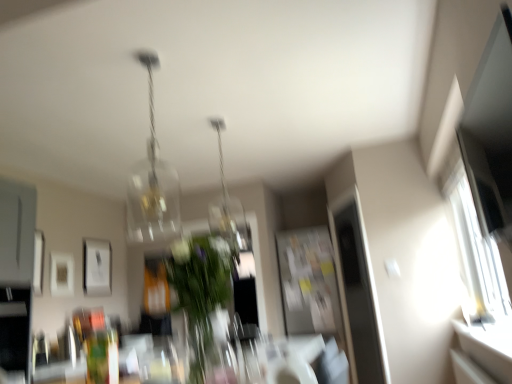
You are a GUI agent. You are given a task and a screenshot of the screen. Output one action in this format:
    pyautogui.click(x=<x>, y=<y>)
    Task: Click on the white matte picture frame at left, arranged as the 2th picture frame when viewed from the front
    This screenshot has height=384, width=512.
    Given the screenshot: What is the action you would take?
    pyautogui.click(x=61, y=274)

Image resolution: width=512 pixels, height=384 pixels. What do you see at coordinates (211, 351) in the screenshot? I see `transparent glass vase at center` at bounding box center [211, 351].

In order to face clear glass pendant light at center, positioned as the 1th lamp in back-to-front order, should I rotate leftwards or rightwards?

To align with it, rotate left about 4.760°.

In order to click on white glossy table at center in this screenshot , I will do `click(308, 346)`.

The width and height of the screenshot is (512, 384). Describe the element at coordinates (38, 262) in the screenshot. I see `matte white picture frame at left, which is counted as the first picture frame, starting from the left` at that location.

Find the location of a particular element. The image size is (512, 384). white matte picture frame at left, positioned as the 2th picture frame in back-to-front order is located at coordinates (61, 274).

Does point (224, 332) appear closer or farther from the camera than point (69, 283)?

Point (224, 332) is closer to the camera than point (69, 283).

Which object is thinner, transparent glass vase at center or white matte picture frame at left, positioned as the 2th picture frame in back-to-front order?

white matte picture frame at left, positioned as the 2th picture frame in back-to-front order.

How different are the orientations of transparent glass vase at center and white matte picture frame at left, positioned as the 2th picture frame in back-to-front order, in degrees?

The facing directions of transparent glass vase at center and white matte picture frame at left, positioned as the 2th picture frame in back-to-front order, are 1.82 degrees apart.

From a real-world perspective, is white matte picture frame at left, positioned as the 2th picture frame in back-to-front order, positioned over white matte picture frame at upper left, the 1th picture frame when ordered from back to front, based on gravity?

No.

From the white matte picture frame at upper left, arranged as the third picture frame when viewed from the front, count the 1st picture frame to the left and point to it. Please provide its 2D coordinates.

[(61, 274)]

In the scene shown: In terms of width, does white matte picture frame at left, arranged as the 2th picture frame when viewed from the front, look wider or thinner when compared to white matte picture frame at upper left, arranged as the third picture frame when viewed from the front?

white matte picture frame at left, arranged as the 2th picture frame when viewed from the front, is thinner than white matte picture frame at upper left, arranged as the third picture frame when viewed from the front.

Is translucent glass chandelier at upper center, positioned as the first lamp in front-to-back order, aimed at transparent glass vase at center?

No, translucent glass chandelier at upper center, positioned as the first lamp in front-to-back order, does not turn towards transparent glass vase at center.

Considering the sizes of objects translucent glass chandelier at upper center, positioned as the first lamp in front-to-back order, and transparent glass vase at center in the image provided, who is shorter, translucent glass chandelier at upper center, positioned as the first lamp in front-to-back order, or transparent glass vase at center?

transparent glass vase at center is shorter.

From the image's perspective, is translucent glass chandelier at upper center, which appears as the 2th lamp when viewed from the back, beneath transparent glass vase at center?

Actually, translucent glass chandelier at upper center, which appears as the 2th lamp when viewed from the back, appears above transparent glass vase at center in the image.

Is translucent glass chandelier at upper center, positioned as the 2th lamp in right-to-left order, far away from transparent glass vase at center?

Yes.

Looking at this image, from the image's perspective, does white matte picture frame at left, which is counted as the 2th picture frame, starting from the right, appear lower than green leafy plant at center?

Yes, from the image's perspective, white matte picture frame at left, which is counted as the 2th picture frame, starting from the right, is below green leafy plant at center.

Is point (52, 287) positioned behind point (200, 265)?

Yes, it is.

Which is behind, white matte picture frame at left, arranged as the 2th picture frame when viewed from the front, or green leafy plant at center?

white matte picture frame at left, arranged as the 2th picture frame when viewed from the front, is more distant.

Between white glossy table at center and matte white picture frame at left, positioned as the third picture frame in back-to-front order, which one has less height?

With less height is white glossy table at center.

Does white glossy table at center appear on the left side of matte white picture frame at left, the first picture frame from the front?

No, white glossy table at center is not to the left of matte white picture frame at left, the first picture frame from the front.

Does white glossy table at center touch matte white picture frame at left, the first picture frame from the front?

No, white glossy table at center is not with matte white picture frame at left, the first picture frame from the front.

From the image's perspective, is white glossy table at center positioned above or below matte white picture frame at left, the first picture frame from the front?

white glossy table at center is below matte white picture frame at left, the first picture frame from the front.

Does transparent glass vase at center have a larger size compared to matte white picture frame at left, which is counted as the first picture frame, starting from the left?

Incorrect, transparent glass vase at center is not larger than matte white picture frame at left, which is counted as the first picture frame, starting from the left.

Based on the photo, what's the angular difference between transparent glass vase at center and matte white picture frame at left, positioned as the third picture frame in back-to-front order,'s facing directions?

transparent glass vase at center and matte white picture frame at left, positioned as the third picture frame in back-to-front order, are facing 1.82 degrees away from each other.

Visually, is transparent glass vase at center positioned to the left or to the right of matte white picture frame at left, positioned as the third picture frame in back-to-front order?

transparent glass vase at center is to the right of matte white picture frame at left, positioned as the third picture frame in back-to-front order.

Is transparent glass vase at center positioned far away from matte white picture frame at left, which is counted as the first picture frame, starting from the left?

That's right, there is a large distance between transparent glass vase at center and matte white picture frame at left, which is counted as the first picture frame, starting from the left.

Is matte white picture frame at left, the third picture frame when ordered from right to left, behind white matte picture frame at left, placed as the 2th picture frame when sorted from left to right?

No, the depth of matte white picture frame at left, the third picture frame when ordered from right to left, is less than that of white matte picture frame at left, placed as the 2th picture frame when sorted from left to right.

Is matte white picture frame at left, the third picture frame when ordered from right to left, positioned with its back to white matte picture frame at left, positioned as the 2th picture frame in back-to-front order?

matte white picture frame at left, the third picture frame when ordered from right to left, does not have its back to white matte picture frame at left, positioned as the 2th picture frame in back-to-front order.

How many degrees apart are the facing directions of matte white picture frame at left, positioned as the third picture frame in back-to-front order, and white matte picture frame at left, which is counted as the 2th picture frame, starting from the right?

The angle between the facing direction of matte white picture frame at left, positioned as the third picture frame in back-to-front order, and the facing direction of white matte picture frame at left, which is counted as the 2th picture frame, starting from the right, is 0.00135 degrees.

Does point (34, 243) lie behind point (73, 285)?

No, (34, 243) is closer to viewer.

Image resolution: width=512 pixels, height=384 pixels. In order to click on glass vase above the white matte picture frame at left, positioned as the 2th picture frame in back-to-front order (from the image's perspective) in this screenshot , I will do `click(211, 351)`.

I want to click on picture frame that is the 1st object to the left of the white matte picture frame at upper left, the 1th picture frame when ordered from back to front, starting at the anchor, so click(61, 274).

Looking at the image, which one is located closer to matte white picture frame at left, which is counted as the first picture frame, starting from the left, green leafy plant at center or white matte picture frame at left, placed as the 2th picture frame when sorted from left to right?

The object closer to matte white picture frame at left, which is counted as the first picture frame, starting from the left, is white matte picture frame at left, placed as the 2th picture frame when sorted from left to right.

Estimate the real-world distances between objects in this image. Which object is further from clear glass pendant light at center, positioned as the 1th lamp in back-to-front order, matte white picture frame at left, the first picture frame from the front, or white matte picture frame at left, arranged as the 2th picture frame when viewed from the front?

Among the two, matte white picture frame at left, the first picture frame from the front, is located further to clear glass pendant light at center, positioned as the 1th lamp in back-to-front order.

Considering their positions, is white matte picture frame at upper left, the third picture frame viewed from the left, positioned further to white matte picture frame at left, positioned as the 2th picture frame in back-to-front order, than white glossy table at center?

white glossy table at center is positioned further to the anchor white matte picture frame at left, positioned as the 2th picture frame in back-to-front order.

Looking at the image, which one is located further to white matte picture frame at upper left, the 1th picture frame viewed from the right, translucent glass chandelier at upper center, which ranks as the 1th lamp in left-to-right order, or white matte picture frame at left, placed as the 2th picture frame when sorted from left to right?

translucent glass chandelier at upper center, which ranks as the 1th lamp in left-to-right order, lies further to white matte picture frame at upper left, the 1th picture frame viewed from the right, than the other object.

From the image, which object appears to be farther from white matte picture frame at left, arranged as the 2th picture frame when viewed from the front, white glossy table at center or matte white picture frame at left, positioned as the third picture frame in back-to-front order?

Among the two, white glossy table at center is located further to white matte picture frame at left, arranged as the 2th picture frame when viewed from the front.

Looking at the image, which one is located closer to green leafy plant at center, white matte picture frame at left, which is counted as the 2th picture frame, starting from the right, or white glossy table at center?

white matte picture frame at left, which is counted as the 2th picture frame, starting from the right, is closer to green leafy plant at center.

Looking at the image, which one is located closer to white glossy window sill at lower right, clear glass pendant light at center, placed as the first lamp when sorted from right to left, or white matte picture frame at upper left, the 1th picture frame when ordered from back to front?

Based on the image, clear glass pendant light at center, placed as the first lamp when sorted from right to left, appears to be nearer to white glossy window sill at lower right.

Based on the photo, which object lies nearer to the anchor point white glossy window sill at lower right, clear glass pendant light at center, positioned as the 1th lamp in back-to-front order, or green leafy plant at center?

Based on the image, clear glass pendant light at center, positioned as the 1th lamp in back-to-front order, appears to be nearer to white glossy window sill at lower right.

This screenshot has width=512, height=384. Find the location of `picture frame between white glossy table at center and white matte picture frame at left, arranged as the 2th picture frame when viewed from the front, along the z-axis`. picture frame between white glossy table at center and white matte picture frame at left, arranged as the 2th picture frame when viewed from the front, along the z-axis is located at coordinates (38, 262).

Where is `lamp between green leafy plant at center and clear glass pendant light at center, which ranks as the second lamp in left-to-right order, along the z-axis`? Image resolution: width=512 pixels, height=384 pixels. lamp between green leafy plant at center and clear glass pendant light at center, which ranks as the second lamp in left-to-right order, along the z-axis is located at coordinates (152, 183).

Identify the location of houseplant located between clear glass pendant light at center, which is the second lamp in front-to-back order, and white glossy window sill at lower right in the left-right direction. The width and height of the screenshot is (512, 384). (201, 284).

Where is `table situated between clear glass pendant light at center, positioned as the 1th lamp in back-to-front order, and white glossy window sill at lower right from left to right`? The height and width of the screenshot is (384, 512). table situated between clear glass pendant light at center, positioned as the 1th lamp in back-to-front order, and white glossy window sill at lower right from left to right is located at coordinates (308, 346).